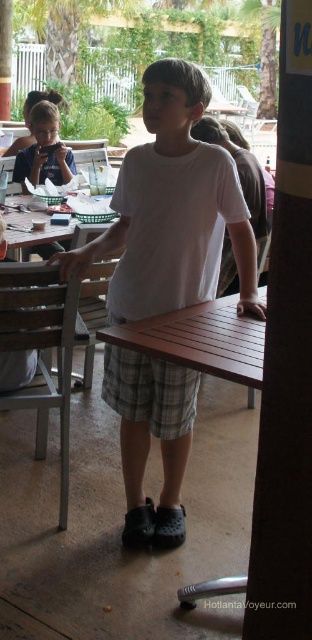
Based on the photo, you are a waiter at this outdoor dining area and need to deliver a drink to the child wearing the white cotton shirt at center. The brown wooden table at center is where the shirt is located. Is the shirt on the left side or right side of the table?

The white cotton shirt at center is positioned on the left side of the brown wooden table at center.

You are a customer at this outdoor dining area and want to sit down. There is a white cotton shirt at center and a brown wooden picnic table at center. Which object should you approach to sit?

The brown wooden picnic table at center is the object you should approach to sit since it is a table designed for seating, and it is located behind the white cotton shirt at center.

You are trying to decide which table to use for a small family gathering. The brown wooden picnic table at center and the brown wooden table at center are both available. Based on their sizes, which one can accommodate more people?

The brown wooden table at center can accommodate more people because it occupies more space than the brown wooden picnic table at center.